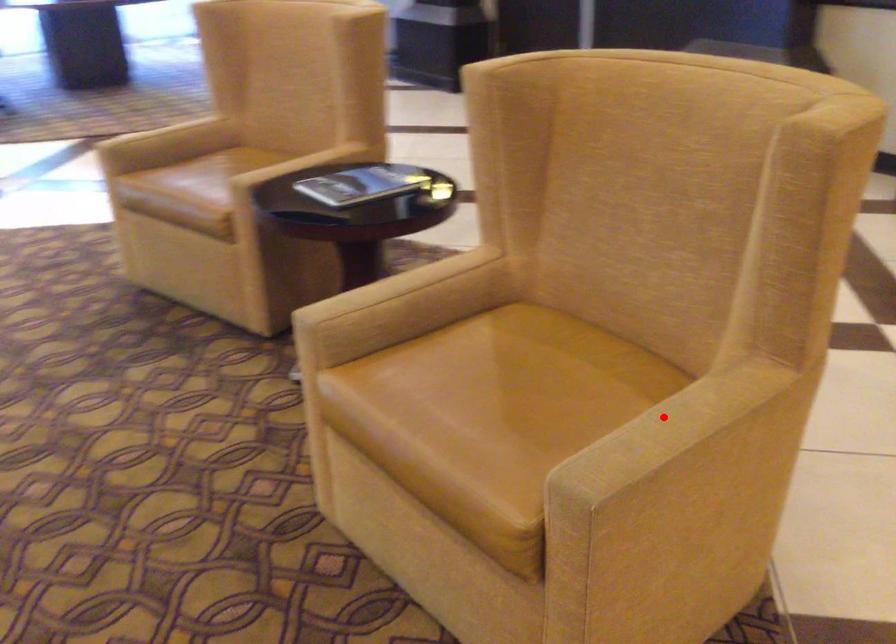
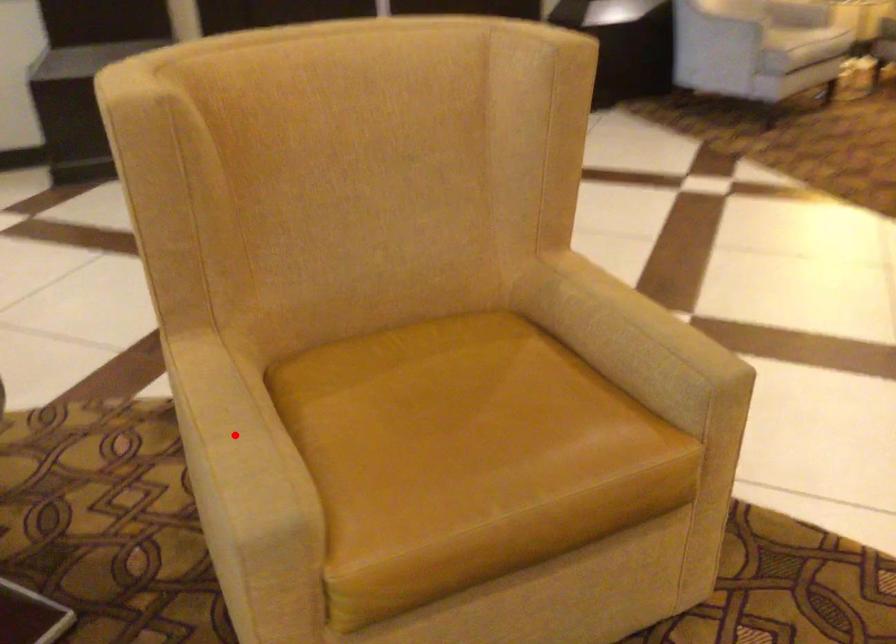
I am providing you with two images of the same scene from different viewpoints. A red point is marked on the first image and another point is marked on the second image. Do the highlighted points in image1 and image2 indicate the same real-world spot?

No